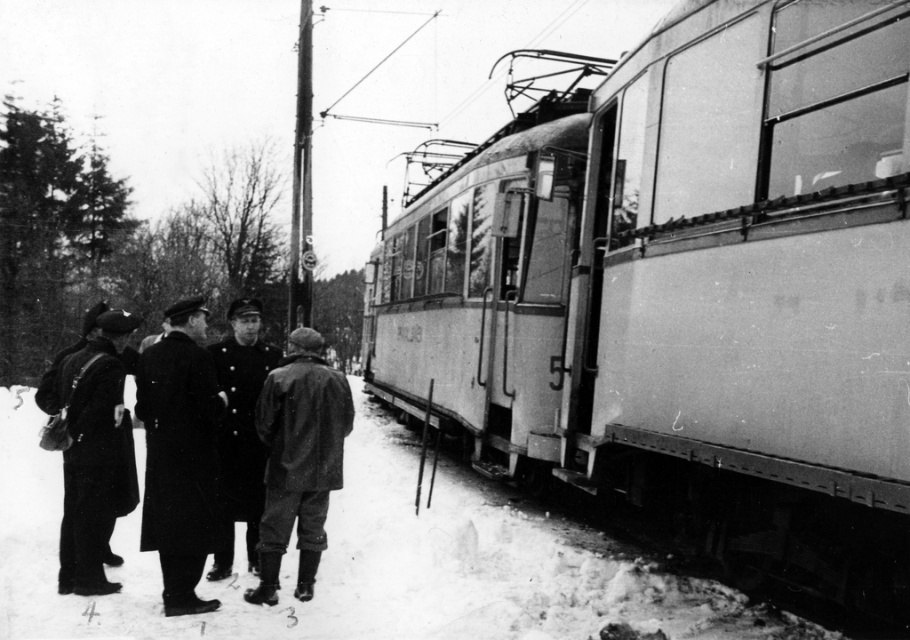
Which of these two, dark wool coat at center or matte black coat at left, stands shorter?

Standing shorter between the two is dark wool coat at center.

Image resolution: width=910 pixels, height=640 pixels. I want to click on dark wool coat at center, so click(179, 452).

Can you confirm if smooth metal train at right is thinner than dark brown leather jacket at center?

Incorrect, smooth metal train at right's width is not less than dark brown leather jacket at center's.

Describe the element at coordinates (686, 291) in the screenshot. The image size is (910, 640). I see `smooth metal train at right` at that location.

Identify the location of smooth metal train at right. (686, 291).

Does dark wool coat at center appear on the right side of uniformed man at center?

Yes, dark wool coat at center is to the right of uniformed man at center.

Is dark wool coat at center to the left of uniformed man at center from the viewer's perspective?

In fact, dark wool coat at center is to the right of uniformed man at center.

Which is in front, point (160, 481) or point (248, 548)?

Point (160, 481)

The height and width of the screenshot is (640, 910). Identify the location of dark wool coat at center. (179, 452).